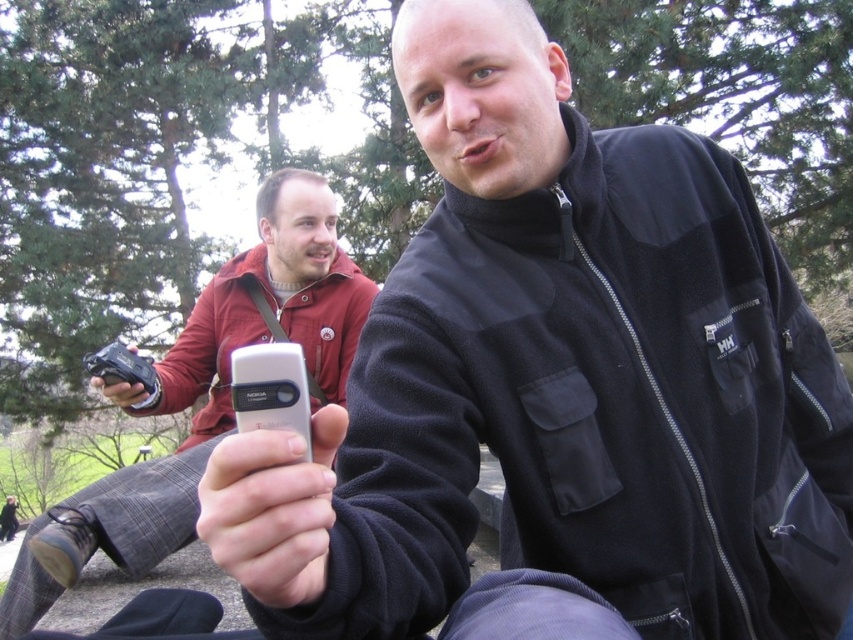
Can you confirm if matte black jacket at upper right is positioned below silver metallic phone at center?

Yes, matte black jacket at upper right is below silver metallic phone at center.

You are a GUI agent. You are given a task and a screenshot of the screen. Output one action in this format:
    pyautogui.click(x=<x>, y=<y>)
    Task: Click on the matte black jacket at upper right
    The height and width of the screenshot is (640, 853).
    Given the screenshot: What is the action you would take?
    pyautogui.click(x=204, y=392)

The image size is (853, 640). Identify the location of matte black jacket at upper right. (204, 392).